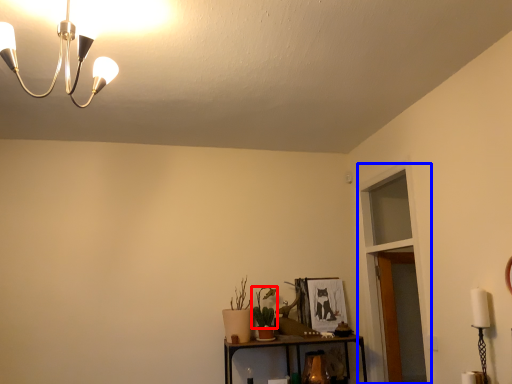
Question: Which of the following is the closest to the observer, plant (highlighted by a red box) or glass door (highlighted by a blue box)?

Choices:
 (A) plant
 (B) glass door

Answer: (B)